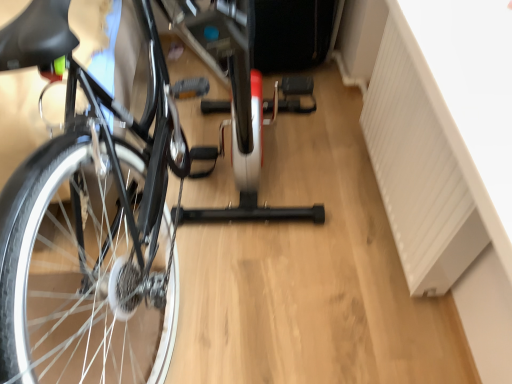
Locate an element on the screen. The image size is (512, 384). shiny black bicycle at left is located at coordinates (113, 204).

Image resolution: width=512 pixels, height=384 pixels. Describe the element at coordinates (113, 204) in the screenshot. I see `shiny black bicycle at left` at that location.

Identify the location of shiny black bicycle at left. (113, 204).